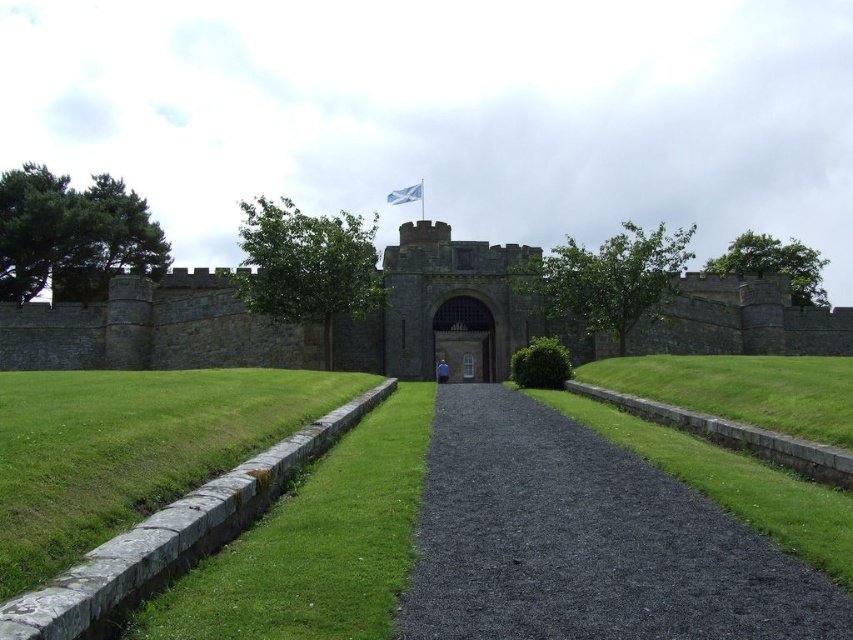
Question: Considering the real-world distances, which object is closest to the green grass at lower left?

Choices:
 (A) stone wall at center
 (B) black gravel path at center
 (C) green grass at center

Answer: (B)

Question: Which of the following is the farthest from the observer?

Choices:
 (A) green grass at lower left
 (B) dark stone gate at center

Answer: (B)

Question: Is black gravel path at center to the right of dark stone gate at center from the viewer's perspective?

Choices:
 (A) no
 (B) yes

Answer: (B)

Question: Does black gravel path at center appear under green grass at center?

Choices:
 (A) no
 (B) yes

Answer: (B)

Question: Is black gravel path at center wider than stone wall at center?

Choices:
 (A) no
 (B) yes

Answer: (A)

Question: Which object is the closest to the green grass at lower left?

Choices:
 (A) stone wall at center
 (B) green grass at center

Answer: (B)